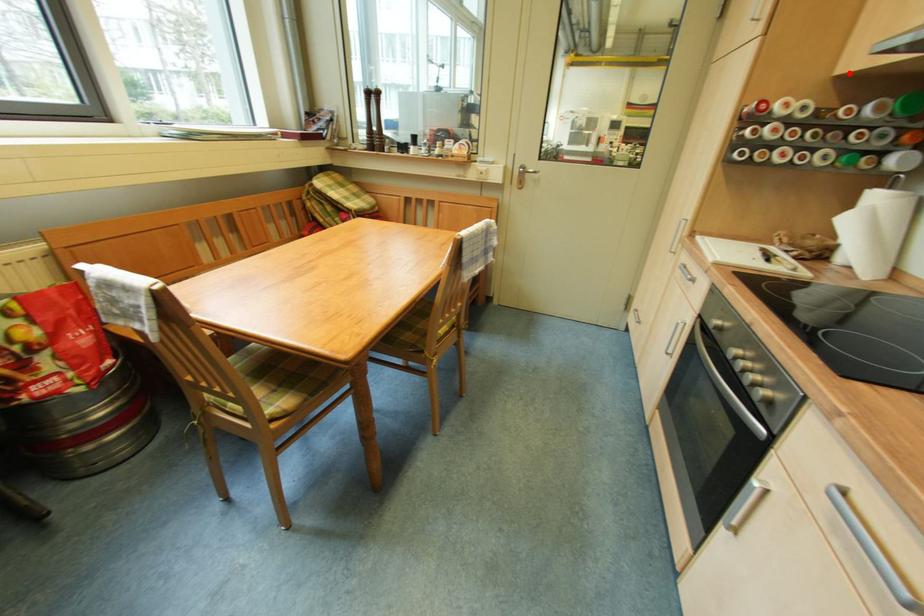
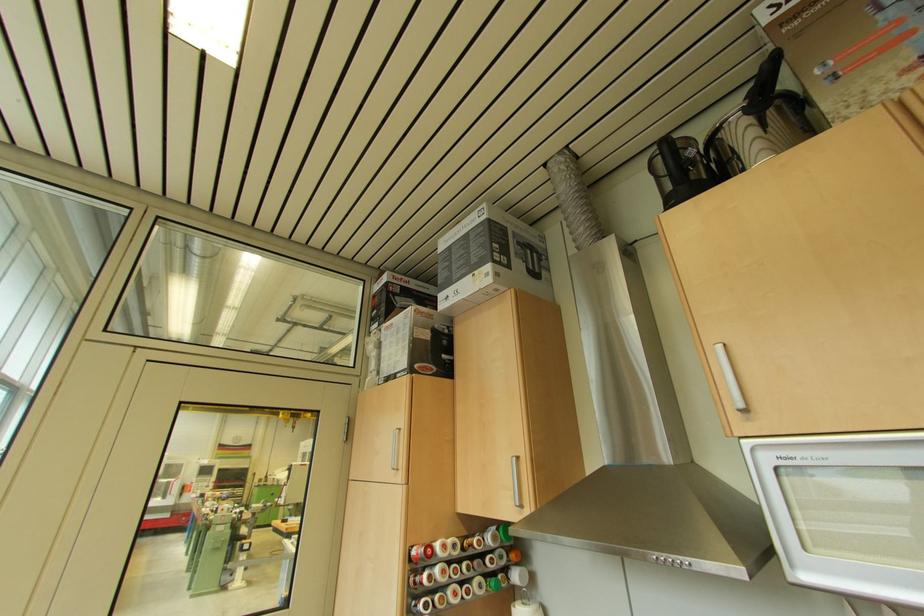
Question: I am providing you with two images of the same scene from different viewpoints. A red point is marked on the first image. Can you still see the location of the red point in image 2?

Choices:
 (A) Yes
 (B) No

Answer: (A)